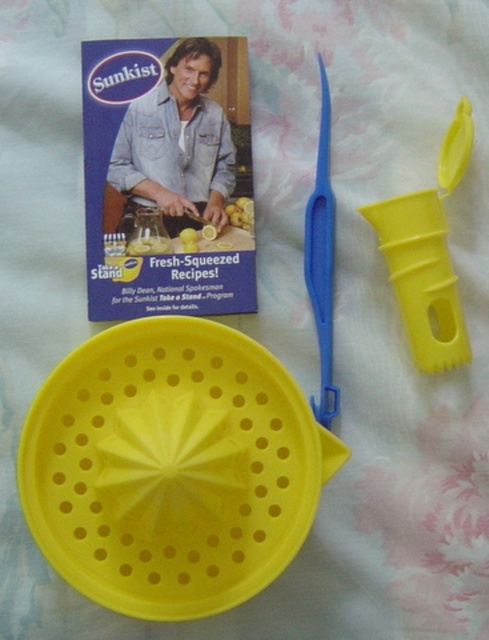
Is yellow matte strainer at center bigger than yellow plastic juicer at right?

Indeed, yellow matte strainer at center has a larger size compared to yellow plastic juicer at right.

Can you confirm if yellow matte strainer at center is shorter than yellow plastic juicer at right?

Indeed, yellow matte strainer at center has a lesser height compared to yellow plastic juicer at right.

Between point (317, 467) and point (439, 186), which one is positioned in front?

Positioned in front is point (317, 467).

I want to click on yellow matte strainer at center, so click(172, 467).

Does yellow plastic juicer at right have a lesser width compared to blue plastic scissors at upper center?

No, yellow plastic juicer at right is not thinner than blue plastic scissors at upper center.

Is yellow plastic juicer at right positioned at the back of blue plastic scissors at upper center?

No, it is not.

At what (x,y) coordinates should I click in order to perform the action: click on yellow plastic juicer at right. Please return your answer as a coordinate pair (x, y). The image size is (489, 640). Looking at the image, I should click on (427, 256).

Measure the distance between yellow matte strainer at center and blue plastic scissors at upper center.

A distance of 26.93 centimeters exists between yellow matte strainer at center and blue plastic scissors at upper center.

Can you confirm if yellow matte strainer at center is positioned above blue plastic scissors at upper center?

No.

Between point (111, 426) and point (305, 228), which one is positioned in front?

Point (111, 426)

The image size is (489, 640). Identify the location of yellow matte strainer at center. (172, 467).